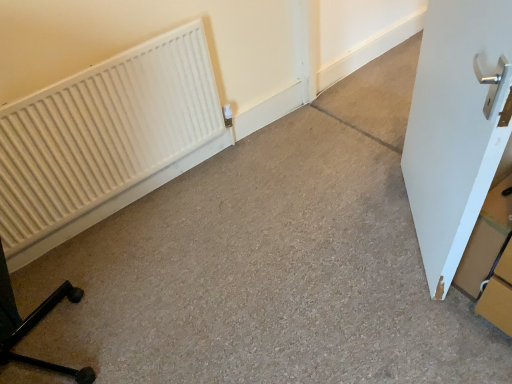
Question: In terms of width, does white matte radiator at left look wider or thinner when compared to cardboard box at right?

Choices:
 (A) wide
 (B) thin

Answer: (B)

Question: Is point click(x=186, y=76) closer or farther from the camera than point click(x=474, y=238)?

Choices:
 (A) closer
 (B) farther

Answer: (B)

Question: Which is nearer to the white matte radiator at left?

Choices:
 (A) cardboard box at right
 (B) white matte door at right

Answer: (B)

Question: Based on their relative distances, which object is farther from the white matte door at right?

Choices:
 (A) white matte radiator at left
 (B) cardboard box at right

Answer: (A)